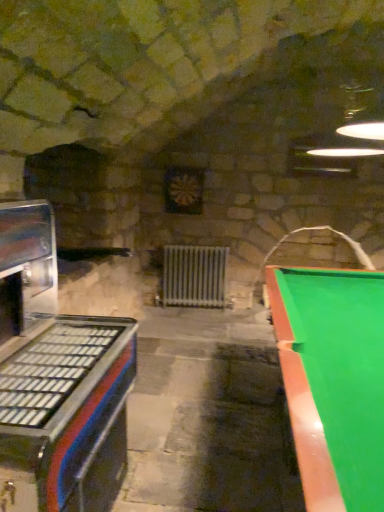
Question: Is metallic blue and red arcade machine at left at the back of green glossy pool table at right?

Choices:
 (A) no
 (B) yes

Answer: (B)

Question: Considering the relative positions of green glossy pool table at right and metallic blue and red arcade machine at left in the image provided, is green glossy pool table at right behind metallic blue and red arcade machine at left?

Choices:
 (A) yes
 (B) no

Answer: (B)

Question: From the image's perspective, does green glossy pool table at right appear lower than metallic blue and red arcade machine at left?

Choices:
 (A) yes
 (B) no

Answer: (A)

Question: Can you confirm if green glossy pool table at right is bigger than metallic blue and red arcade machine at left?

Choices:
 (A) yes
 (B) no

Answer: (A)

Question: Can you confirm if green glossy pool table at right is positioned to the right of metallic blue and red arcade machine at left?

Choices:
 (A) no
 (B) yes

Answer: (B)

Question: Is green glossy pool table at right placed right next to metallic blue and red arcade machine at left?

Choices:
 (A) no
 (B) yes

Answer: (A)

Question: Does metallic blue and red arcade machine at left come behind white metallic radiator at center?

Choices:
 (A) yes
 (B) no

Answer: (B)

Question: From the image's perspective, is metallic blue and red arcade machine at left on top of white metallic radiator at center?

Choices:
 (A) yes
 (B) no

Answer: (B)

Question: Is metallic blue and red arcade machine at left bigger than white metallic radiator at center?

Choices:
 (A) no
 (B) yes

Answer: (B)

Question: From the image's perspective, is metallic blue and red arcade machine at left under white metallic radiator at center?

Choices:
 (A) yes
 (B) no

Answer: (A)

Question: Is metallic blue and red arcade machine at left at the left side of white metallic radiator at center?

Choices:
 (A) no
 (B) yes

Answer: (B)

Question: From a real-world perspective, is metallic blue and red arcade machine at left below white metallic radiator at center?

Choices:
 (A) no
 (B) yes

Answer: (A)

Question: Considering the relative sizes of white metallic radiator at center and green glossy pool table at right in the image provided, is white metallic radiator at center wider than green glossy pool table at right?

Choices:
 (A) no
 (B) yes

Answer: (A)